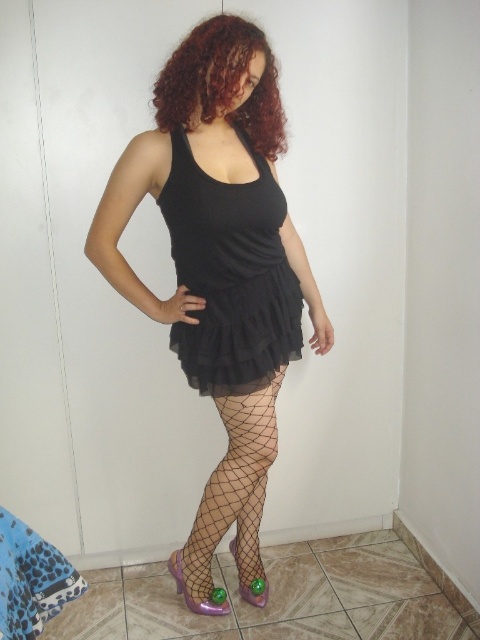
You are a fashion designer trying to place a new accessory on the model. The accessory must be placed exactly at the point indicated by the coordinates point (x=219, y=262). What item of clothing is located at this point on the model?

The point (x=219, y=262) corresponds to the matte black dress at center, so the accessory should be placed on the matte black dress at center.

You are a photographer setting up a shoot in this room. You want to ensure that both the curly red hair at upper center and the purple fishnet shoe at lower center are in focus. Given that your camera can only focus on objects within a 1 meter depth range, can you capture both in focus?

The curly red hair at upper center is closer to the viewer than the purple fishnet shoe at lower center. Since the camera can focus on objects within a 1 meter depth range, you need to check if the distance between them is within this range. However, without specific measurements, we can only confirm their relative positions. If the depth difference between them is less than 1 meter, they can be in focus.

You are a photographer setting up a shot in the described scene. You need to position a spotlight exactly 2 meters away from the camera to highlight a specific point. Given the point labeled as point (195, 35), is this point within the required distance for the spotlight placement?

The point (195, 35) is 1.51 meters from the camera. Since the required distance is 2 meters, the point is closer than needed. Therefore, the spotlight placed at this point would not meet the 2 meter requirement.